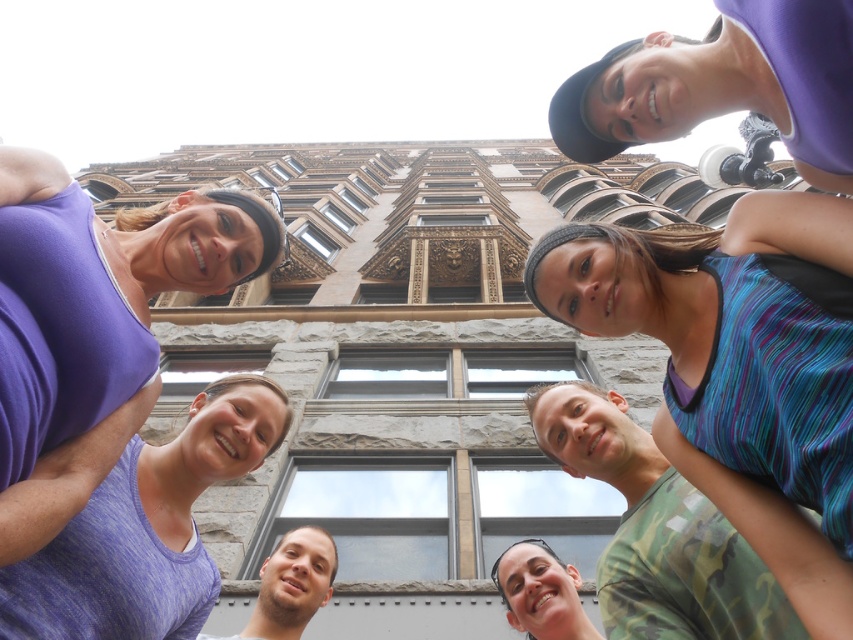
From the picture: You are a photographer who wants to take a closeup shot of the striped fabric tank top at center and the matte black hair at lower center. Since the camera can only focus on one subject at a time, which one should you choose to ensure it appears larger in the photo?

The striped fabric tank top at center is bigger than the matte black hair at lower center, so you should focus on the striped fabric tank top at center to ensure it appears larger in the photo.

You are standing in front of a large classical building and looking up at the scene. There are two points marked on the building wall, one at point coordinates point (335, 557) and another at point (521, 592). Which point is closer to you?

Point (335, 557) is further to the viewer than point (521, 592), so the point closer to you is point (521, 592).